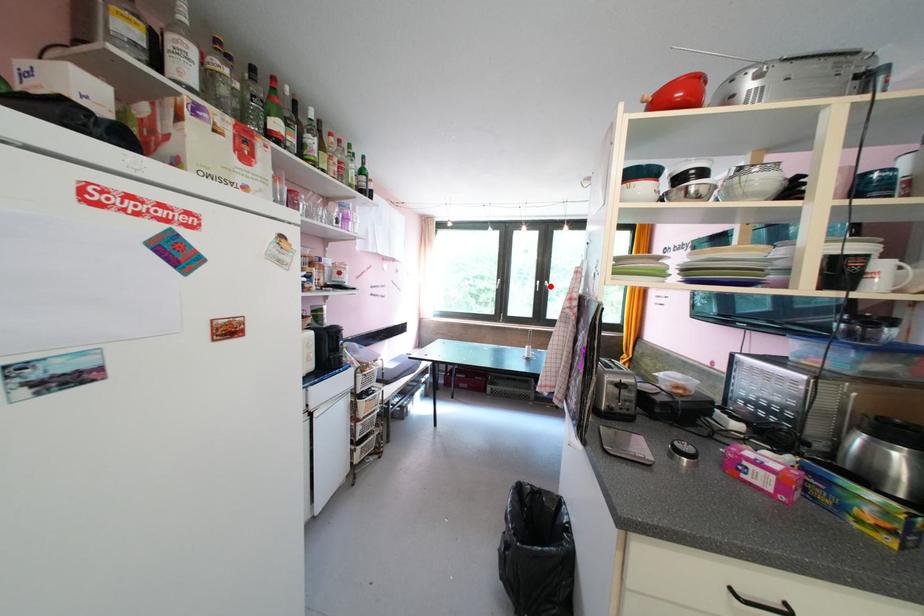
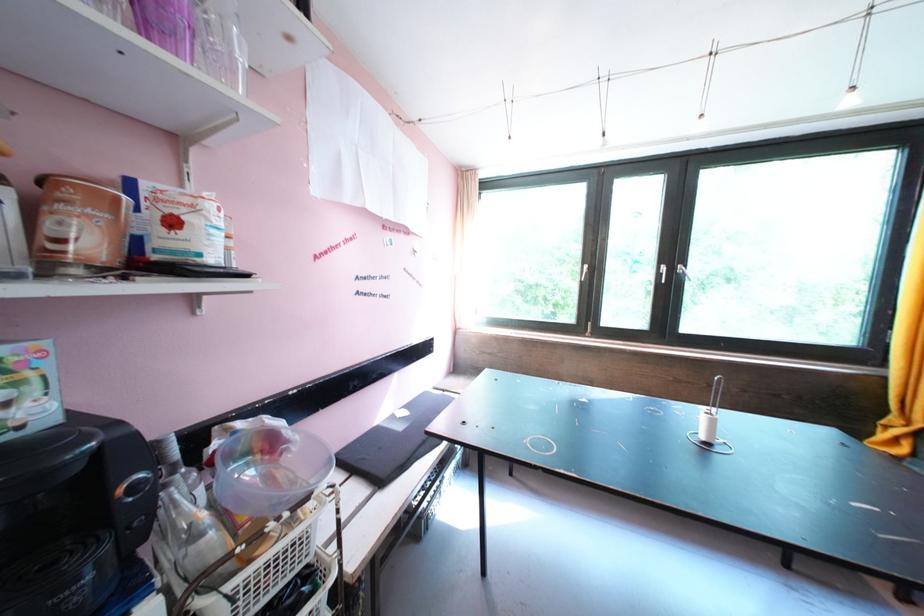
Where in the second image is the point corresponding to the highlighted location from the first image?

(679, 273)